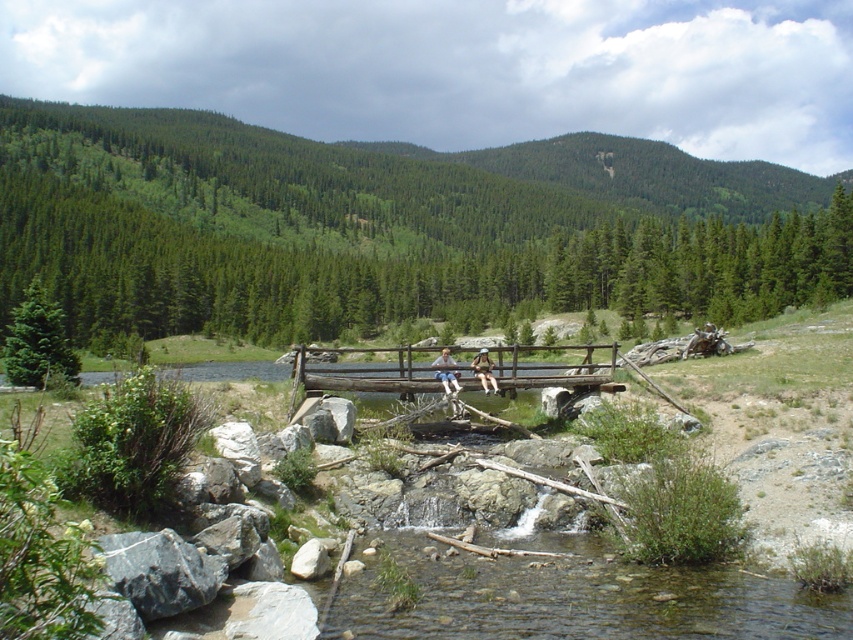
How distant is brown wooden bridge at center from matte black shorts at center?

brown wooden bridge at center and matte black shorts at center are 148.98 feet apart.

Find the location of a particular element. This screenshot has height=640, width=853. brown wooden bridge at center is located at coordinates (384, 376).

Who is positioned more to the left, clear water at center or light brown wooden bench at center?

clear water at center

Can you confirm if clear water at center is wider than light brown wooden bench at center?

No, clear water at center is not wider than light brown wooden bench at center.

Locate an element on the screen. clear water at center is located at coordinates (567, 595).

Between brown wooden bridge at center and light brown wooden bench at center, which one is positioned higher?

Positioned higher is light brown wooden bench at center.

Can you confirm if brown wooden bridge at center is positioned to the left of light brown wooden bench at center?

No, brown wooden bridge at center is not to the left of light brown wooden bench at center.

Does point (376, 369) come closer to viewer compared to point (486, 381)?

No, it is behind (486, 381).

The width and height of the screenshot is (853, 640). What are the coordinates of `brown wooden bridge at center` in the screenshot? It's located at (384, 376).